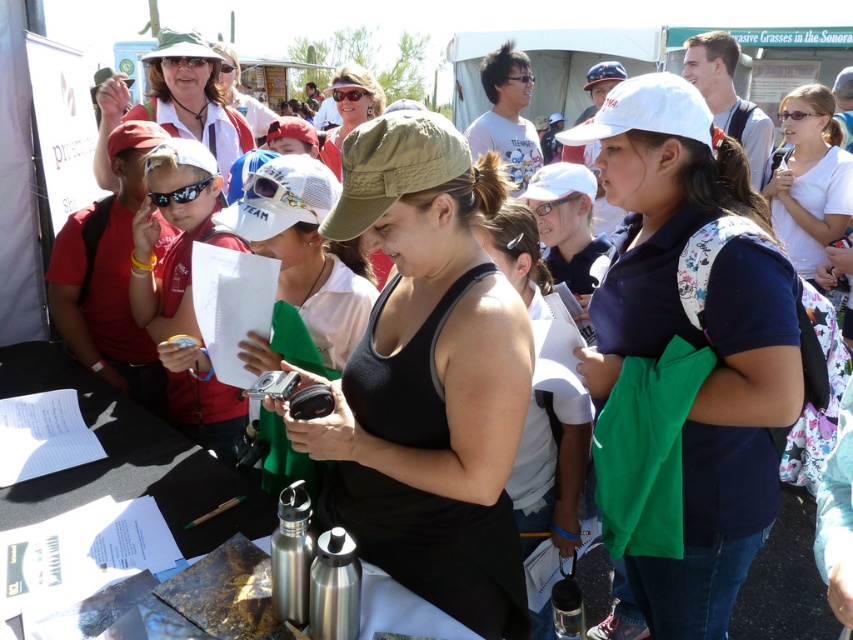
Does navy blue polo shirt at center appear on the right side of matte white hat at upper center?

Correct, you'll find navy blue polo shirt at center to the right of matte white hat at upper center.

Which is below, navy blue polo shirt at center or matte white hat at upper center?

navy blue polo shirt at center

Locate an element on the screen. navy blue polo shirt at center is located at coordinates (732, 432).

How distant is matte red shirt at center from white cotton shirt at upper right?

The distance of matte red shirt at center from white cotton shirt at upper right is 10.51 feet.

Can you confirm if matte red shirt at center is positioned above white cotton shirt at upper right?

Incorrect, matte red shirt at center is not positioned above white cotton shirt at upper right.

The height and width of the screenshot is (640, 853). I want to click on matte red shirt at center, so click(x=107, y=276).

Is point (500, 280) farther from viewer compared to point (323, 148)?

That is False.

Between black matte tank top at center and matte khaki cap at center, which one is positioned lower?

Positioned lower is black matte tank top at center.

What do you see at coordinates (428, 378) in the screenshot?
I see `black matte tank top at center` at bounding box center [428, 378].

This screenshot has height=640, width=853. In order to click on black matte tank top at center in this screenshot , I will do `click(428, 378)`.